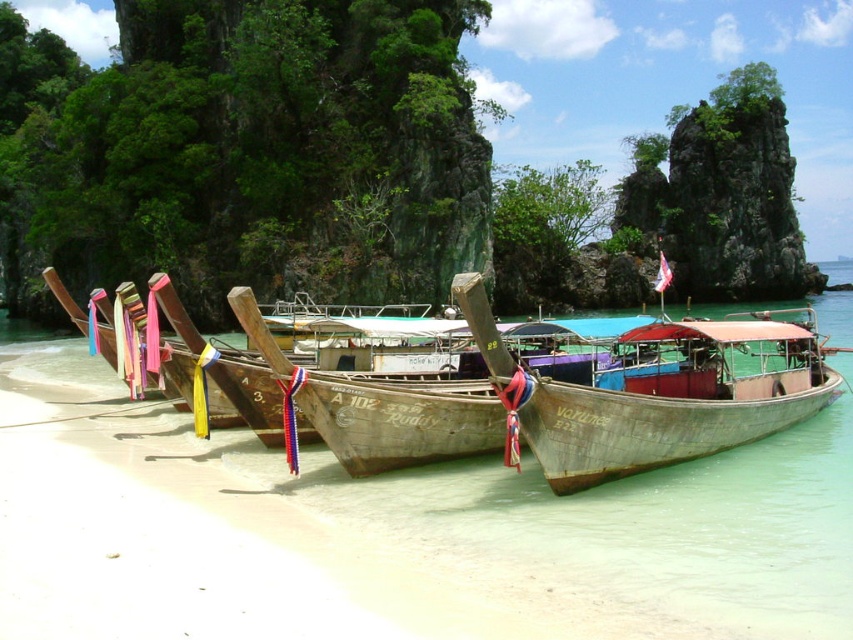
Question: Is wooden longboat at center wider than wooden boat at center?

Choices:
 (A) no
 (B) yes

Answer: (B)

Question: Can you confirm if wooden longboat at center is bigger than wooden boat at center?

Choices:
 (A) yes
 (B) no

Answer: (A)

Question: Among these objects, which one is nearest to the camera?

Choices:
 (A) wooden longboat at center
 (B) wooden boat at center

Answer: (B)

Question: Is wooden longboat at center below wooden boat at center?

Choices:
 (A) yes
 (B) no

Answer: (B)